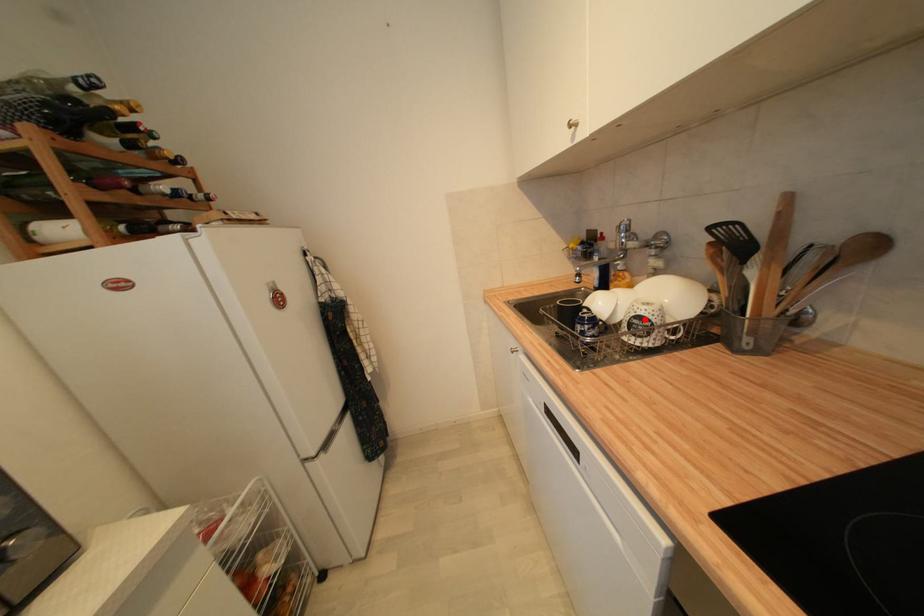
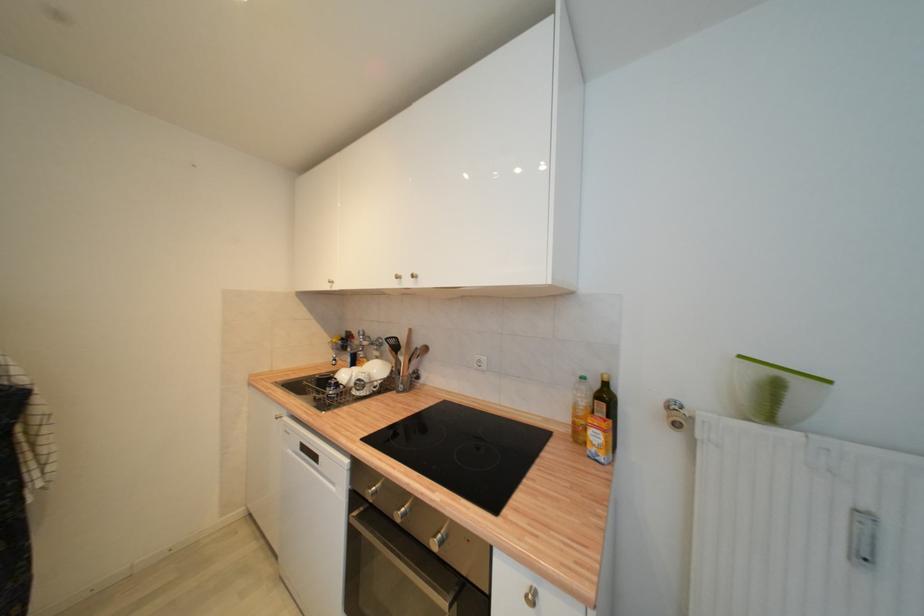
Find the pixel in the second image that matches the highlighted location in the first image.

(363, 382)